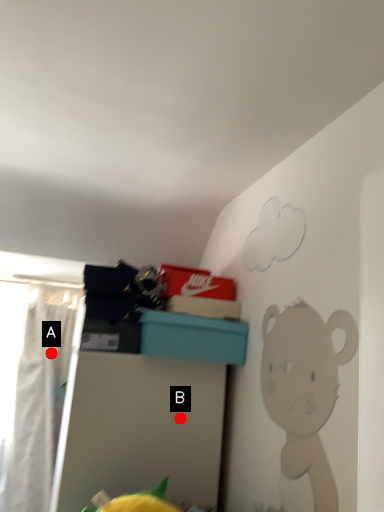
Question: Two points are circled on the image, labeled by A and B beside each circle. Which point is closer to the camera?

Choices:
 (A) A is closer
 (B) B is closer

Answer: (B)